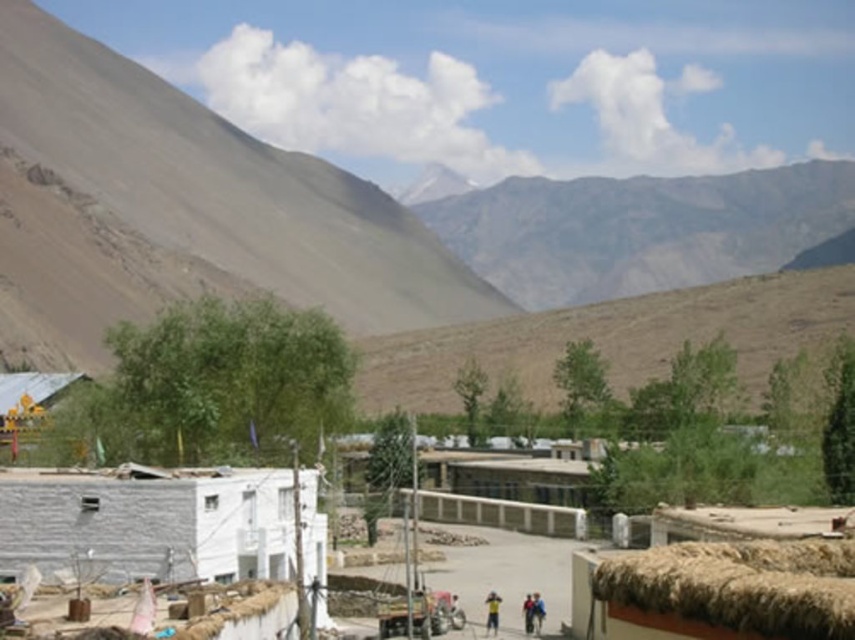
You are standing at the viewpoint of the image and want to reach the point marked at coordinates (184,148). If your walking speed is 3 feet per second, how many seconds will it take you to reach that point?

The point marked at coordinates (184,148) is 864.74 feet away from the viewer. At a walking speed of 3 feet per second, it would take 864.74 divided by 3, which is approximately 288.25 seconds to reach that point.

You are standing at the point marked as point (144, 522). What object are you closest to?

You are closest to the white concrete wall at lower left, as the point (144, 522) represents its location.